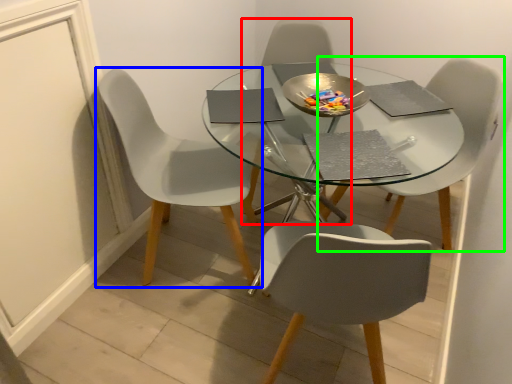
Question: Based on their relative distances, which object is nearer to chair (highlighted by a red box)? Choose from chair (highlighted by a blue box) and chair (highlighted by a green box).

Choices:
 (A) chair
 (B) chair

Answer: (A)